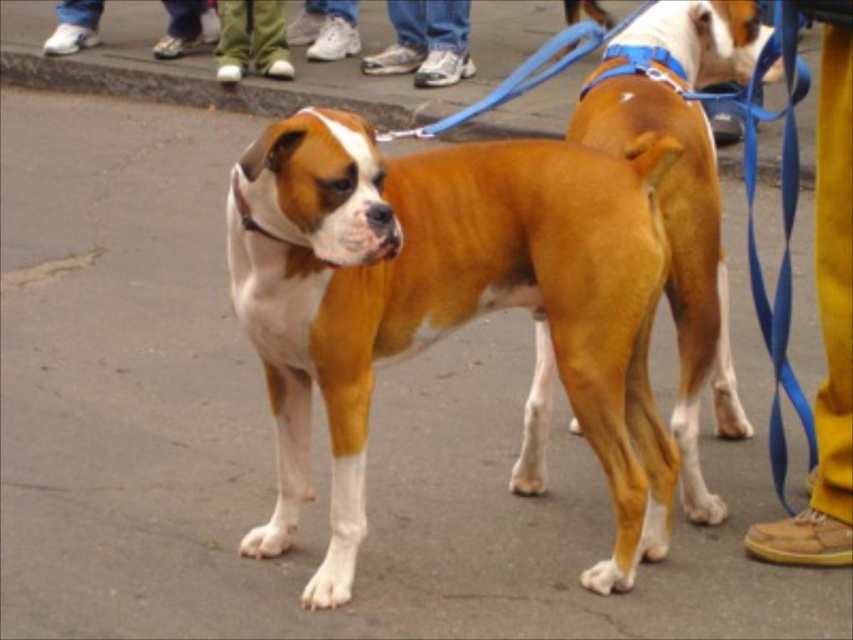
Is brown glossy dog at center below white leather shoes at lower left?

Indeed, brown glossy dog at center is positioned under white leather shoes at lower left.

Is point (695, 70) farther from camera compared to point (193, 44)?

No.

Is point (743, 65) positioned in front of point (207, 4)?

Yes, it is.

You are a GUI agent. You are given a task and a screenshot of the screen. Output one action in this format:
    pyautogui.click(x=<x>, y=<y>)
    Task: Click on the brown glossy dog at center
    The image size is (853, 640).
    Given the screenshot: What is the action you would take?
    pyautogui.click(x=682, y=193)

Does yellow fabric pants at lower right appear on the left side of white leather shoe at lower center?

No, yellow fabric pants at lower right is not to the left of white leather shoe at lower center.

The height and width of the screenshot is (640, 853). What are the coordinates of `yellow fabric pants at lower right` in the screenshot? It's located at (827, 317).

Does yellow fabric pants at lower right have a lesser height compared to green fabric pants at upper center?

Incorrect, yellow fabric pants at lower right's height does not fall short of green fabric pants at upper center's.

Is yellow fabric pants at lower right smaller than green fabric pants at upper center?

No, yellow fabric pants at lower right is not smaller than green fabric pants at upper center.

Where is `yellow fabric pants at lower right`? yellow fabric pants at lower right is located at coordinates (827, 317).